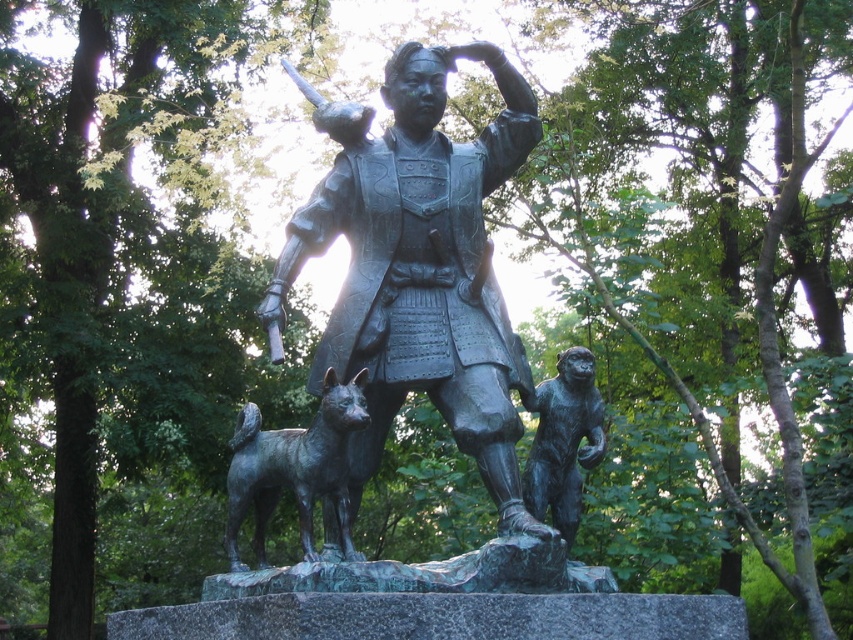
Is bronze statue at center to the left of bronze monkey at right from the viewer's perspective?

Yes, bronze statue at center is to the left of bronze monkey at right.

What do you see at coordinates (416, 266) in the screenshot? The width and height of the screenshot is (853, 640). I see `bronze statue at center` at bounding box center [416, 266].

From the picture: Who is more distant from viewer, (445, 195) or (584, 456)?

Positioned behind is point (445, 195).

At what (x,y) coordinates should I click in order to perform the action: click on bronze statue at center. Please return your answer as a coordinate pair (x, y). Looking at the image, I should click on (416, 266).

What do you see at coordinates (416, 266) in the screenshot? I see `bronze statue at center` at bounding box center [416, 266].

Does bronze statue at center have a lesser width compared to bronze dog at center?

In fact, bronze statue at center might be wider than bronze dog at center.

Does point (409, 182) lie behind point (349, 392)?

Yes.

Where is `bronze statue at center`? bronze statue at center is located at coordinates (416, 266).

At what (x,y) coordinates should I click in order to perform the action: click on bronze dog at center. Please return your answer as a coordinate pair (x, y). The width and height of the screenshot is (853, 640). Looking at the image, I should click on (294, 468).

Is bronze dog at center above bronze monkey at right?

Incorrect, bronze dog at center is not positioned above bronze monkey at right.

The image size is (853, 640). I want to click on bronze dog at center, so click(294, 468).